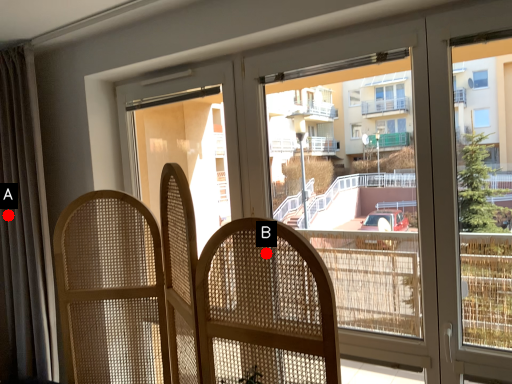
Question: Two points are circled on the image, labeled by A and B beside each circle. Among these points, which one is farthest from the camera?

Choices:
 (A) A is further
 (B) B is further

Answer: (A)